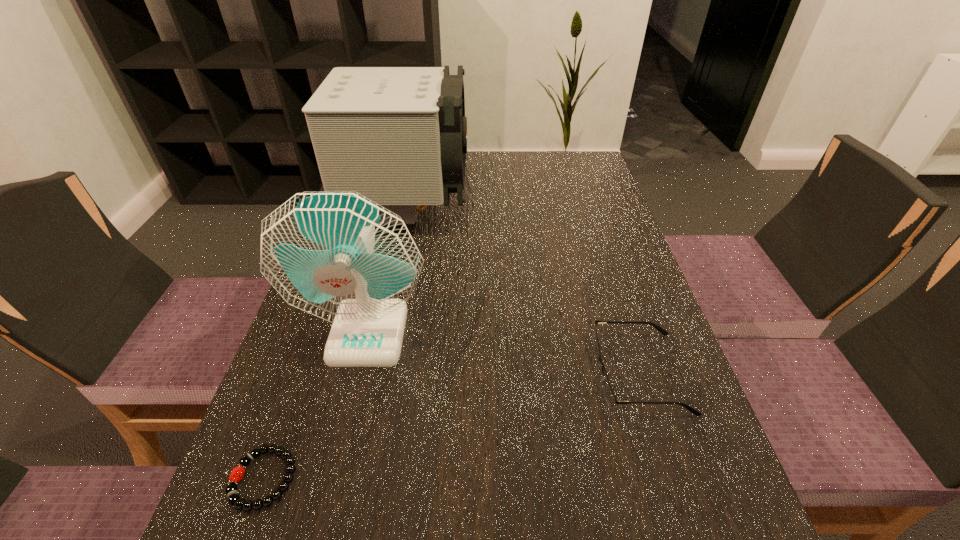
The width and height of the screenshot is (960, 540). In order to click on vacant area between the nearest object and the rightmost object in this screenshot , I will do `click(451, 426)`.

Image resolution: width=960 pixels, height=540 pixels. In order to click on free point between the farther fan and the third tallest object in this screenshot , I will do `click(523, 292)`.

The width and height of the screenshot is (960, 540). I want to click on vacant space in between the third tallest object and the nearer fan, so click(x=504, y=353).

I want to click on free space between the farthest object and the rightmost object, so pyautogui.click(x=523, y=292).

This screenshot has height=540, width=960. Find the location of `vacant space that is in between the nearer fan and the spectacles`. vacant space that is in between the nearer fan and the spectacles is located at coordinates pos(504,353).

Find the location of a particular element. The width and height of the screenshot is (960, 540). object that stands as the third closest to the shortest object is located at coordinates (397, 135).

I want to click on object that is the third nearest to the nearer fan, so click(x=610, y=397).

Where is `free spot that satisfies the following two spatial constraints: 1. on the back side of the bracelet; 2. on the left side of the farthest object`? The image size is (960, 540). free spot that satisfies the following two spatial constraints: 1. on the back side of the bracelet; 2. on the left side of the farthest object is located at coordinates click(x=361, y=210).

You are a GUI agent. You are given a task and a screenshot of the screen. Output one action in this format:
    pyautogui.click(x=<x>, y=<y>)
    Task: Click on the free space in the image that satisfies the following two spatial constraints: 1. on the back side of the nearest object; 2. on the right side of the farther fan
    This screenshot has height=540, width=960.
    Given the screenshot: What is the action you would take?
    pyautogui.click(x=361, y=210)